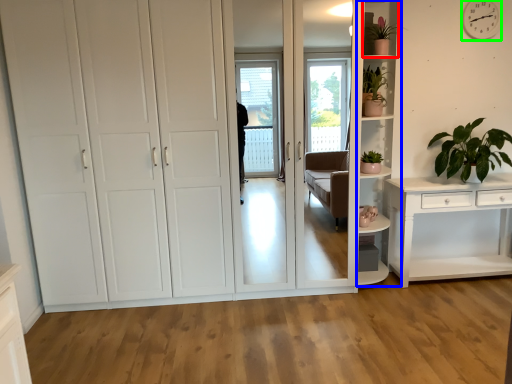
Question: Based on their relative distances, which object is farther from shelf (highlighted by a red box)? Choose from shelf (highlighted by a blue box) and clock (highlighted by a green box).

Choices:
 (A) shelf
 (B) clock

Answer: (B)